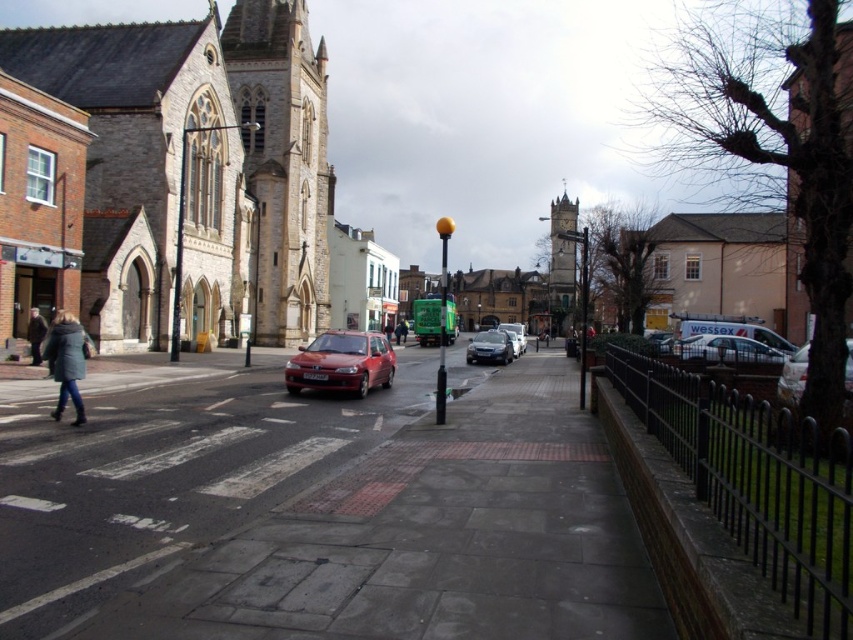
You are a pedestrian standing on the sidewalk and want to take a photo of the smooth brown church at right. However, there is a metallic silver van at right blocking your view. Can you still see the church from your current position?

The smooth brown church at right is located above the metallic silver van at right, so yes, you can still see the church from your current position as it is positioned higher than the van.

You are a pedestrian standing on the street and see the dark gray stone church at upper left and the dark green coat at left. Which object is located more to the left side of the street?

The dark gray stone church at upper left is positioned on the left side of the dark green coat at left, so it is more to the left side of the street.